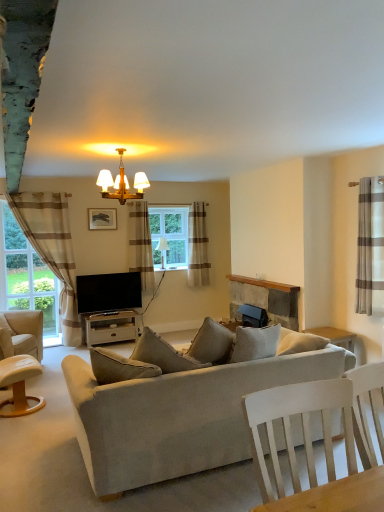
Question: Should I look upward or downward to see matte white lampshade at center, which is counted as the second lamp, starting from the top?

Choices:
 (A) up
 (B) down

Answer: (A)

Question: Does white wood tv stand at center have a lesser height compared to matte white lampshade at center, which is counted as the second lamp, starting from the top?

Choices:
 (A) no
 (B) yes

Answer: (B)

Question: From the image's perspective, is white wood tv stand at center over matte white lampshade at center, which is counted as the second lamp, starting from the top?

Choices:
 (A) no
 (B) yes

Answer: (A)

Question: Does white wood tv stand at center have a larger size compared to matte white lampshade at center, which is counted as the second lamp, starting from the top?

Choices:
 (A) no
 (B) yes

Answer: (B)

Question: Is white wood tv stand at center not near matte white lampshade at center, the 1th lamp positioned from the bottom?

Choices:
 (A) yes
 (B) no

Answer: (A)

Question: Can you confirm if white wood tv stand at center is positioned to the left of matte white lampshade at center, which is counted as the 1th lamp, starting from the back?

Choices:
 (A) yes
 (B) no

Answer: (A)

Question: From a real-world perspective, is white wood tv stand at center on top of matte white lampshade at center, which is counted as the 1th lamp, starting from the back?

Choices:
 (A) no
 (B) yes

Answer: (A)

Question: From the image's perspective, is matte gold chandelier at upper center, which is the first lamp in top-to-bottom order, on matte black picture frame at upper center?

Choices:
 (A) no
 (B) yes

Answer: (B)

Question: Can you confirm if matte gold chandelier at upper center, positioned as the 2th lamp in back-to-front order, is positioned to the left of matte black picture frame at upper center?

Choices:
 (A) no
 (B) yes

Answer: (A)

Question: Is matte gold chandelier at upper center, positioned as the 2th lamp in back-to-front order, facing away from matte black picture frame at upper center?

Choices:
 (A) no
 (B) yes

Answer: (B)

Question: From a real-world perspective, is matte gold chandelier at upper center, positioned as the 2th lamp in back-to-front order, beneath matte black picture frame at upper center?

Choices:
 (A) yes
 (B) no

Answer: (B)

Question: Does matte gold chandelier at upper center, marked as the 1th lamp in a front-to-back arrangement, have a lesser height compared to matte black picture frame at upper center?

Choices:
 (A) no
 (B) yes

Answer: (A)

Question: Is matte gold chandelier at upper center, which is the first lamp in top-to-bottom order, next to matte black picture frame at upper center?

Choices:
 (A) yes
 (B) no

Answer: (B)

Question: Is brown striped curtain at center, the third curtain from the front, positioned far away from beige striped curtain at right, the first curtain viewed from the front?

Choices:
 (A) no
 (B) yes

Answer: (B)